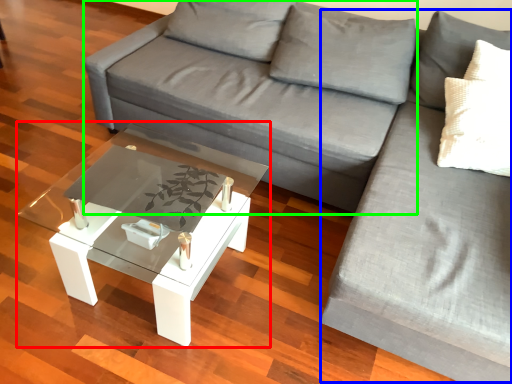
Question: Which object is the closest to the coffee table (highlighted by a red box)? Choose among these: couch (highlighted by a blue box) or couch (highlighted by a green box).

Choices:
 (A) couch
 (B) couch

Answer: (B)